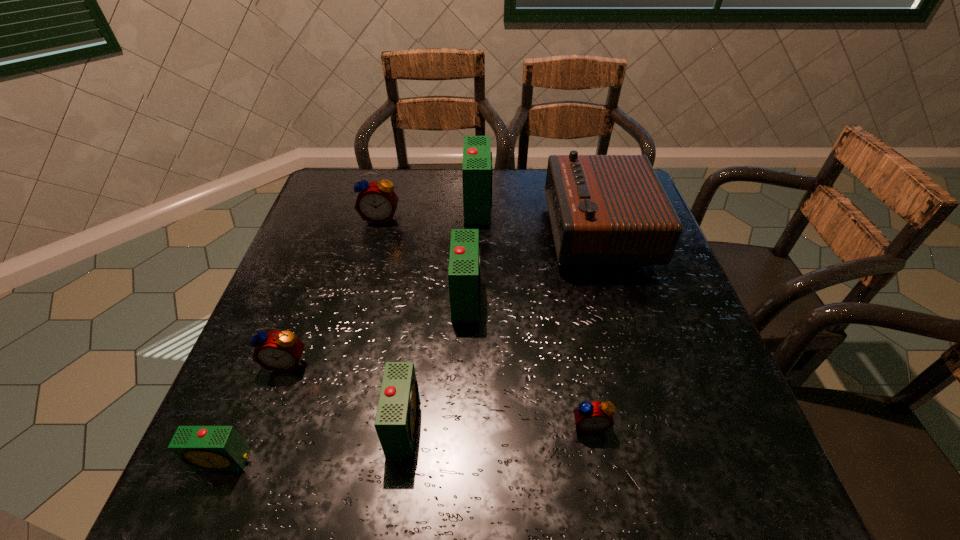
Locate an element on the screen. The height and width of the screenshot is (540, 960). free point located on the front-facing side of the second smallest red alarm clock is located at coordinates (272, 406).

You are a GUI agent. You are given a task and a screenshot of the screen. Output one action in this format:
    pyautogui.click(x=<x>, y=<y>)
    Task: Click on the blank space located 0.350m on the front-facing side of the third green alarm clock from right to left
    The height and width of the screenshot is (540, 960).
    Given the screenshot: What is the action you would take?
    pyautogui.click(x=613, y=424)

Locate an element on the screen. vacant area situated 0.050m on the front-facing side of the rightmost red alarm clock is located at coordinates (597, 462).

This screenshot has width=960, height=540. Find the location of `radio receiver that is positioned at the far edge`. radio receiver that is positioned at the far edge is located at coordinates (605, 210).

This screenshot has width=960, height=540. I want to click on object at the right edge, so click(x=605, y=210).

Find the location of a particular element. The width and height of the screenshot is (960, 540). object present at the far left corner is located at coordinates (376, 202).

The height and width of the screenshot is (540, 960). I want to click on object that is positioned at the near left corner, so click(202, 448).

The height and width of the screenshot is (540, 960). I want to click on object that is positioned at the far right corner, so click(605, 210).

Image resolution: width=960 pixels, height=540 pixels. In the image, there is a desktop. In order to click on free space at the far edge in this screenshot , I will do `click(402, 215)`.

You are a GUI agent. You are given a task and a screenshot of the screen. Output one action in this format:
    pyautogui.click(x=<x>, y=<y>)
    Task: Click on the vacant space at the near edge
    Image resolution: width=960 pixels, height=540 pixels.
    Given the screenshot: What is the action you would take?
    pyautogui.click(x=335, y=449)